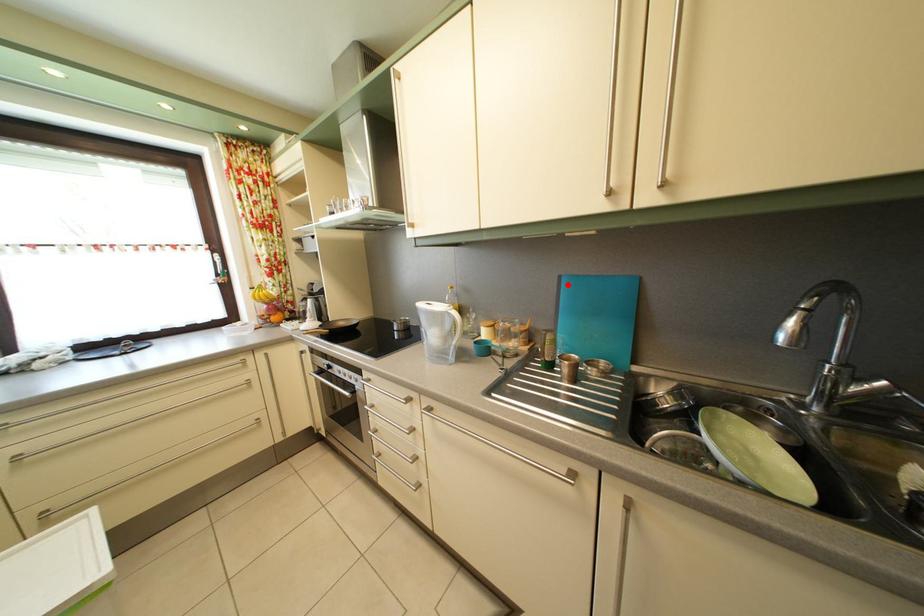
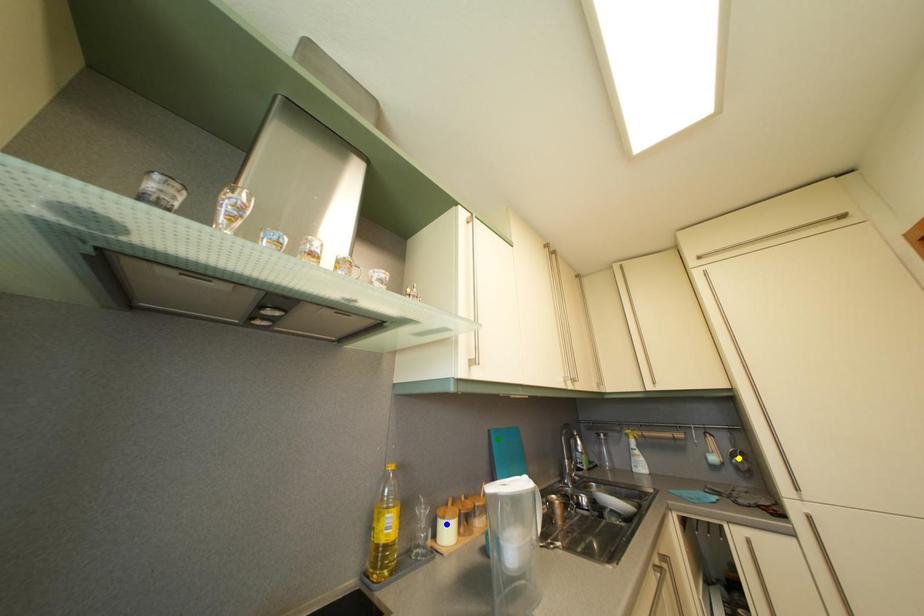
Question: I am providing you with two images of the same scene from different viewpoints. A red point is marked on the first image. You are given multiple points on the second image. Which point in image 2 is actually the same real-world point as the red point in image 1?

Choices:
 (A) green point
 (B) blue point
 (C) yellow point

Answer: (A)